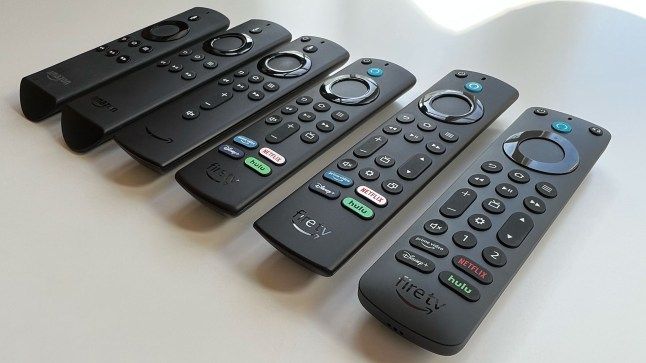
Locate an element on the screen. The width and height of the screenshot is (646, 363). remotes is located at coordinates (121, 59), (150, 80), (201, 117), (269, 136), (362, 172), (455, 195).